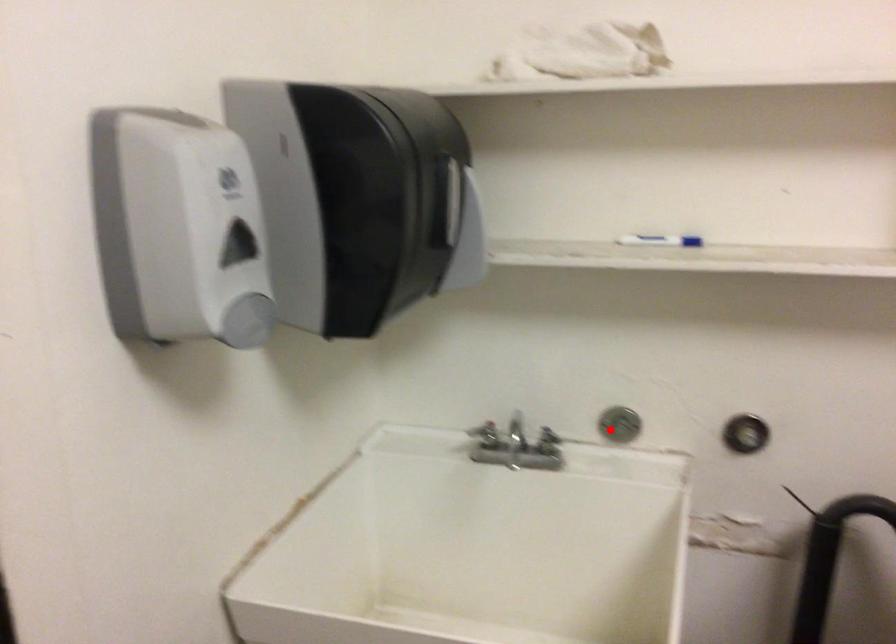
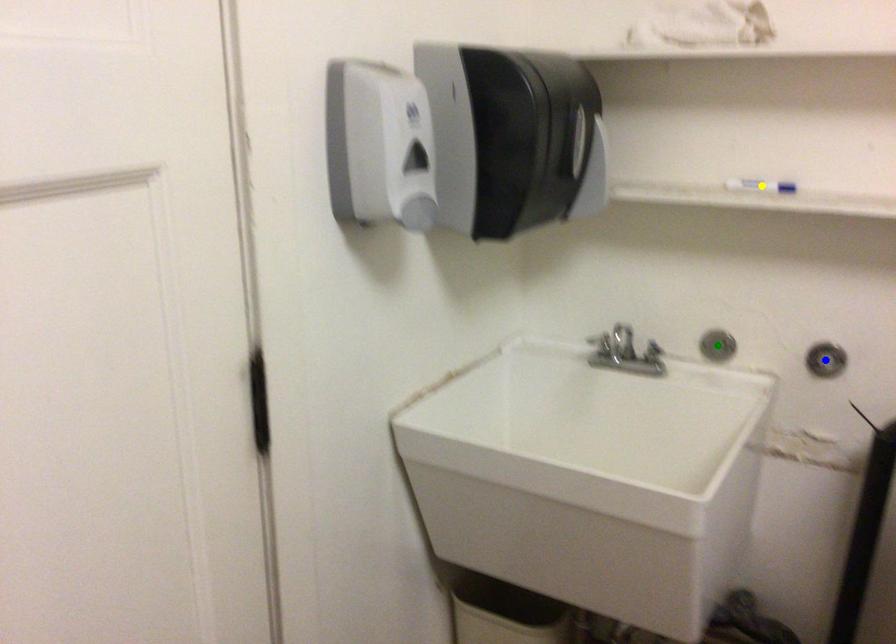
Question: I am providing you with two images of the same scene from different viewpoints. A red point is marked on the first image. You are given multiple points on the second image. Which point in image 2 is actually the same real-world point as the red point in image 1?

Choices:
 (A) blue point
 (B) yellow point
 (C) green point

Answer: (C)